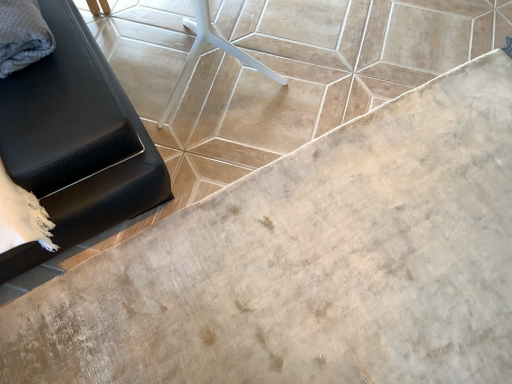
Question: Should I look upward or downward to see gray textured fabric at upper left?

Choices:
 (A) down
 (B) up

Answer: (B)